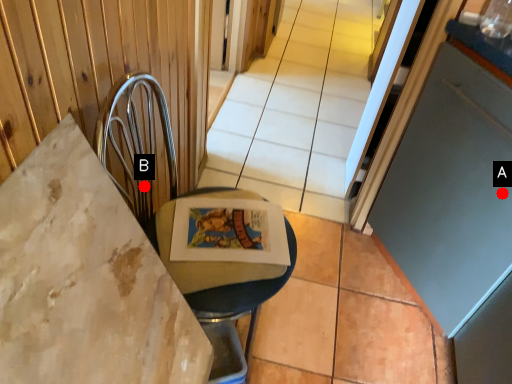
Question: Two points are circled on the image, labeled by A and B beside each circle. Which point is closer to the camera?

Choices:
 (A) A is closer
 (B) B is closer

Answer: (A)